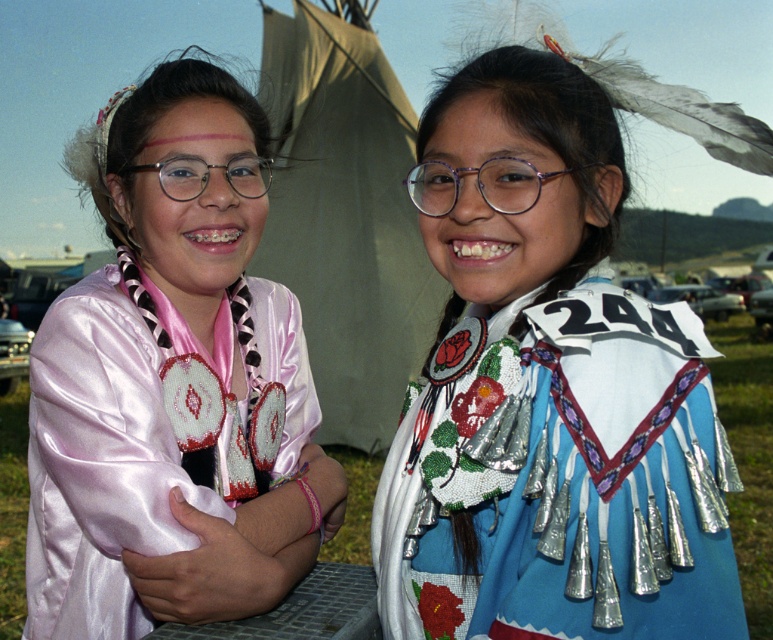
You are a photographer at the event and want to ensure both the blue beaded dress at center and the beige canvas tent at center are visible in your photo. Given their sizes, which one should you focus on to include both in the frame?

The blue beaded dress at center is much taller than the beige canvas tent at center, so you should focus on the beige canvas tent at center to ensure both are visible in the frame.

You are a photographer at the event and need to capture both the blue beaded dress at center and the satin pink blouse at left in a single frame. Which clothing item will appear narrower in the photo?

The blue beaded dress at center will appear narrower in the photo because its width is less than the satin pink blouse at left.